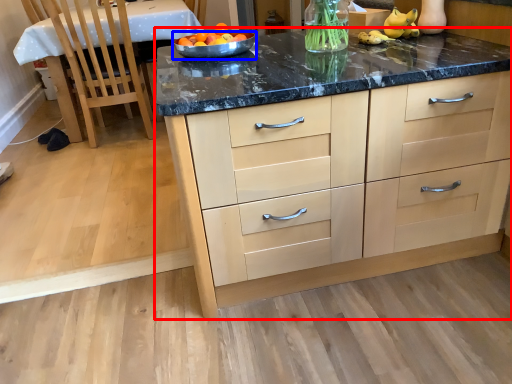
Question: Which of the following is the farthest to the observer, cabinetry (highlighted by a red box) or bowl (highlighted by a blue box)?

Choices:
 (A) cabinetry
 (B) bowl

Answer: (B)